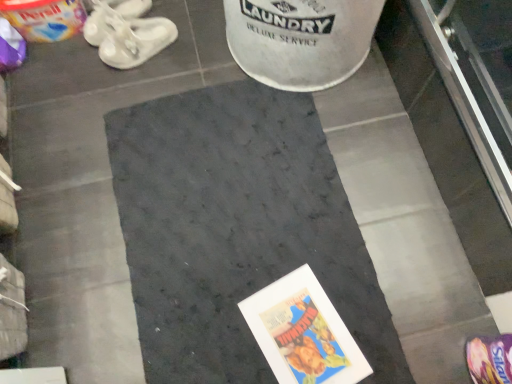
Question: Is dark gray carpet at center smaller than white rubber shoes at upper left, the 3th footwear when ordered from front to back?

Choices:
 (A) yes
 (B) no

Answer: (B)

Question: From the image's perspective, is dark gray carpet at center located above white rubber shoes at upper left, the 3th footwear when ordered from front to back?

Choices:
 (A) yes
 (B) no

Answer: (B)

Question: Is dark gray carpet at center positioned in front of white rubber shoes at upper left, which is the first footwear in left-to-right order?

Choices:
 (A) no
 (B) yes

Answer: (B)

Question: Is dark gray carpet at center taller than white rubber shoes at upper left, which is the 3th footwear in bottom-to-top order?

Choices:
 (A) no
 (B) yes

Answer: (A)

Question: From a real-world perspective, is dark gray carpet at center located higher than white rubber shoes at upper left, the first footwear positioned from the top?

Choices:
 (A) no
 (B) yes

Answer: (A)

Question: From the image's perspective, relative to white rubber shoes at upper left, placed as the 1th footwear when sorted from back to front, is dark gray carpet at center above or below?

Choices:
 (A) above
 (B) below

Answer: (B)

Question: Does point (192, 223) appear closer or farther from the camera than point (98, 28)?

Choices:
 (A) closer
 (B) farther

Answer: (A)

Question: Looking at the image, does dark gray carpet at center seem bigger or smaller compared to white rubber shoes at upper left, which is the 3th footwear in bottom-to-top order?

Choices:
 (A) small
 (B) big

Answer: (B)

Question: From a real-world perspective, is dark gray carpet at center positioned above or below white rubber shoes at upper left, placed as the 1th footwear when sorted from back to front?

Choices:
 (A) above
 (B) below

Answer: (B)

Question: Which is correct: white rubber sandals at upper left, the 2th footwear when ordered from bottom to top, is inside dark gray carpet at center, or outside of it?

Choices:
 (A) outside
 (B) inside

Answer: (A)

Question: Looking at their shapes, would you say white rubber sandals at upper left, the 2th footwear when ordered from bottom to top, is wider or thinner than dark gray carpet at center?

Choices:
 (A) thin
 (B) wide

Answer: (A)

Question: From a real-world perspective, is white rubber sandals at upper left, which is the second footwear from right to left, above or below dark gray carpet at center?

Choices:
 (A) above
 (B) below

Answer: (A)

Question: Based on their positions, is white rubber sandals at upper left, the 2th footwear positioned from the top, located to the left or right of dark gray carpet at center?

Choices:
 (A) right
 (B) left

Answer: (B)

Question: Does point (480, 337) appear closer or farther from the camera than point (120, 49)?

Choices:
 (A) farther
 (B) closer

Answer: (B)

Question: From a real-world perspective, is purple fabric footwear at lower right, which ranks as the third footwear in back-to-front order, above or below white rubber sandals at upper left, the 2th footwear positioned from the top?

Choices:
 (A) below
 (B) above

Answer: (B)